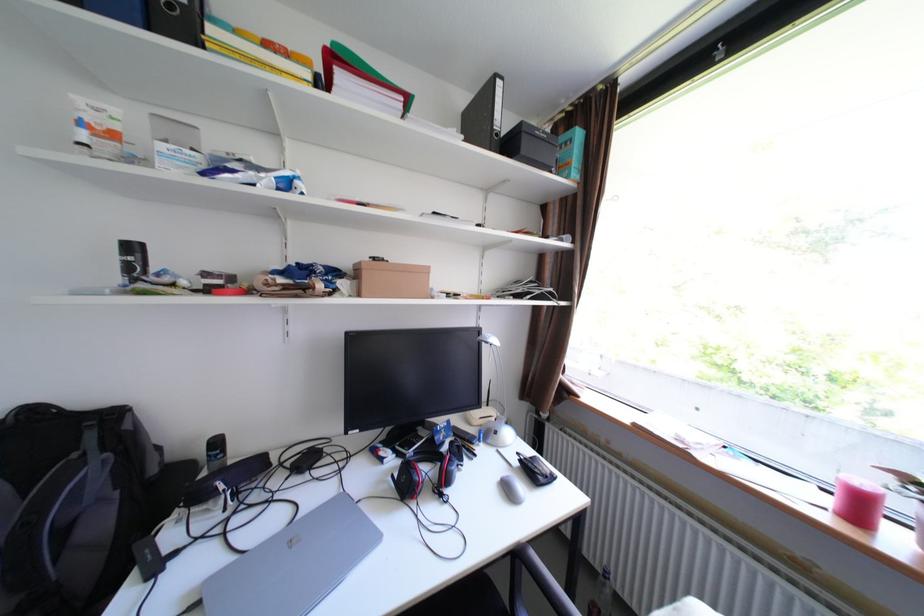
What do you see at coordinates (719, 53) in the screenshot? I see `a black window handle` at bounding box center [719, 53].